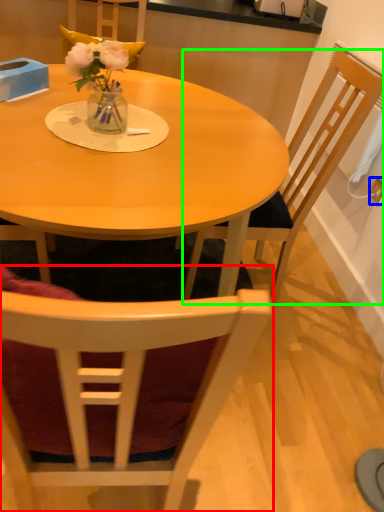
Question: Estimate the real-world distances between objects in this image. Which object is farther from chair (highlighted by a red box), power outlet (highlighted by a blue box) or chair (highlighted by a green box)?

Choices:
 (A) power outlet
 (B) chair

Answer: (A)